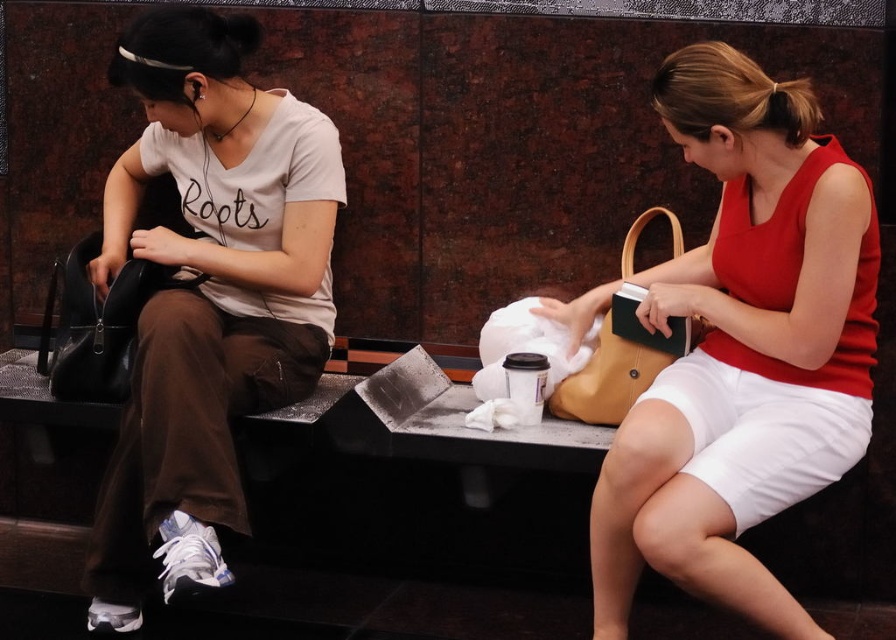
Who is higher up, black leather handbag at left or matte brown handbag at right?

black leather handbag at left is higher up.

Who is shorter, black leather handbag at left or matte brown handbag at right?

matte brown handbag at right is shorter.

Is point (151, 280) closer to viewer compared to point (582, 372)?

Yes, it is in front of point (582, 372).

Find the location of a particular element. This screenshot has width=896, height=640. black leather handbag at left is located at coordinates (97, 323).

Consider the image. Is matte black purse at left below matte brown handbag at right?

No.

In order to click on matte black purse at left in this screenshot , I will do `click(207, 296)`.

Where is `matte black purse at left`? The image size is (896, 640). matte black purse at left is located at coordinates (207, 296).

Does point (860, 204) lie behind point (561, 413)?

No, it is not.

How distant is matte yellow purse at right from matte brown handbag at right?

matte yellow purse at right and matte brown handbag at right are 29.65 centimeters apart.

Does point (657, 301) come closer to viewer compared to point (673, 240)?

Yes, it is.

You are a GUI agent. You are given a task and a screenshot of the screen. Output one action in this format:
    pyautogui.click(x=<x>, y=<y>)
    Task: Click on the matte yellow purse at right
    
    Given the screenshot: What is the action you would take?
    pyautogui.click(x=743, y=349)